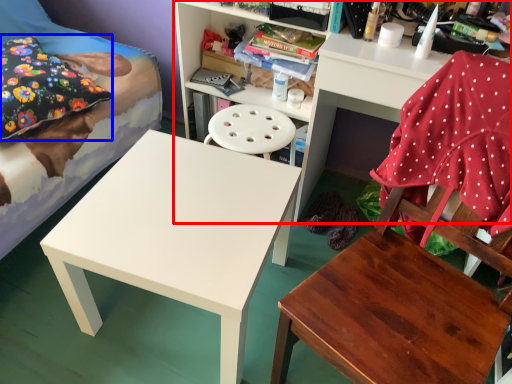
Question: Which of the following is the farthest to the observer, shelf (highlighted by a red box) or pillow (highlighted by a blue box)?

Choices:
 (A) shelf
 (B) pillow

Answer: (B)